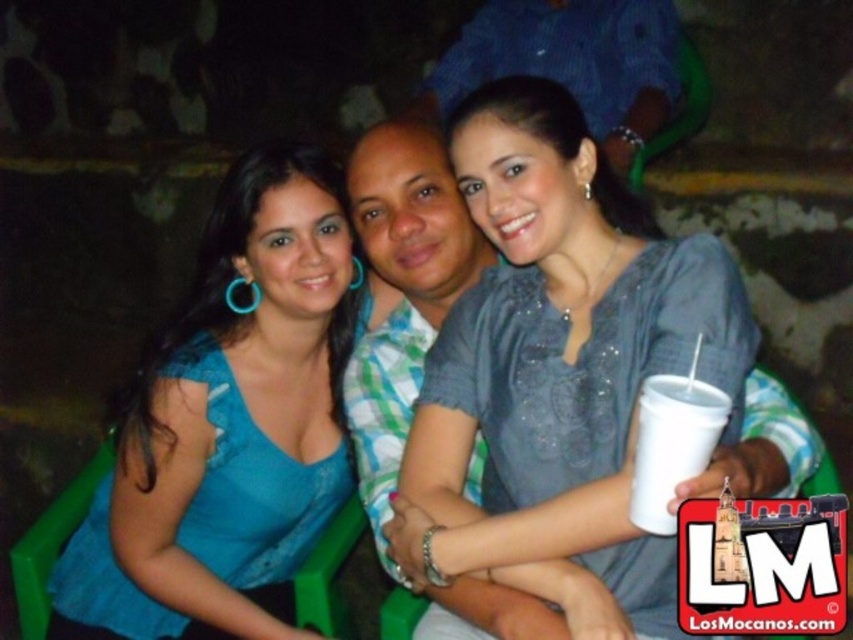
Is gray matte shirt at center to the right of white styrofoam cup at lower right from the viewer's perspective?

No, gray matte shirt at center is not to the right of white styrofoam cup at lower right.

Find the location of a particular element. Image resolution: width=853 pixels, height=640 pixels. gray matte shirt at center is located at coordinates (560, 358).

Is blue fabric top at center bigger than blue plaid shirt at center?

Incorrect, blue fabric top at center is not larger than blue plaid shirt at center.

Does blue fabric top at center lie in front of blue plaid shirt at center?

Yes.

Is point (207, 289) in front of point (631, 10)?

Yes.

Locate an element on the screen. blue fabric top at center is located at coordinates (227, 426).

Is gray matte shirt at center bigger than blue plaid shirt at center?

No.

Is point (502, 272) positioned after point (578, 60)?

No, it is not.

Which is behind, point (555, 96) or point (660, 86)?

The point (660, 86) is behind.

Identify the location of gray matte shirt at center. (560, 358).